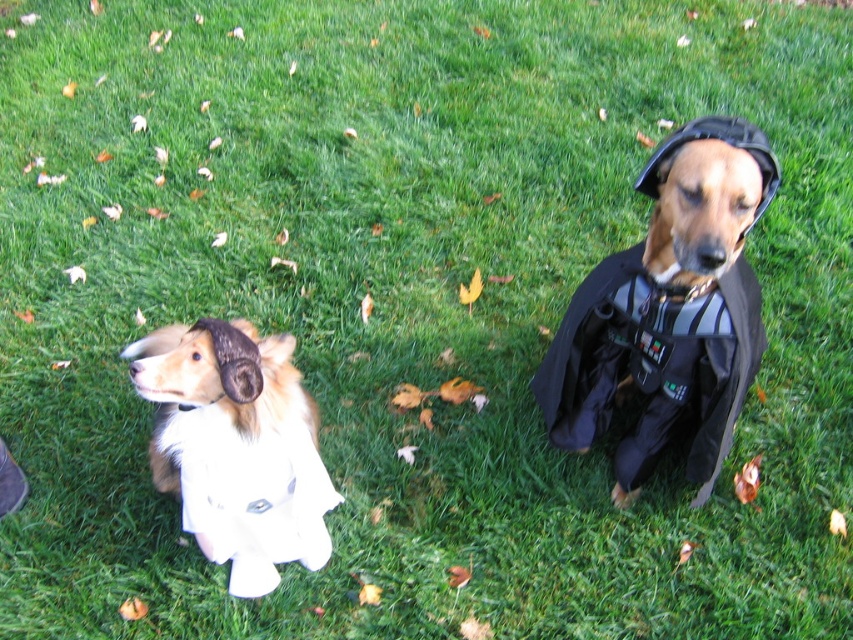
Does shiny black cape at right have a smaller size compared to white fluffy dog at left?

Actually, shiny black cape at right might be larger than white fluffy dog at left.

Can you confirm if shiny black cape at right is positioned to the right of white fluffy dog at left?

Indeed, shiny black cape at right is positioned on the right side of white fluffy dog at left.

This screenshot has width=853, height=640. I want to click on shiny black cape at right, so click(x=669, y=310).